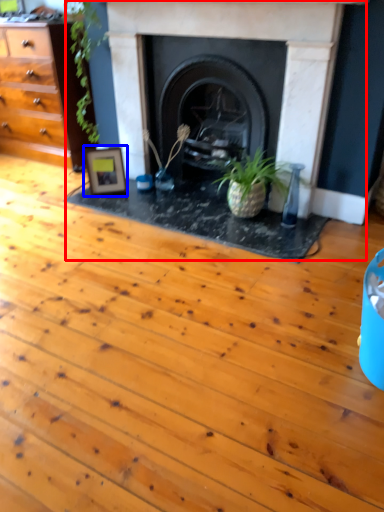
Question: Which of the following is the closest to the observer, fireplace (highlighted by a red box) or picture frame (highlighted by a blue box)?

Choices:
 (A) fireplace
 (B) picture frame

Answer: (A)